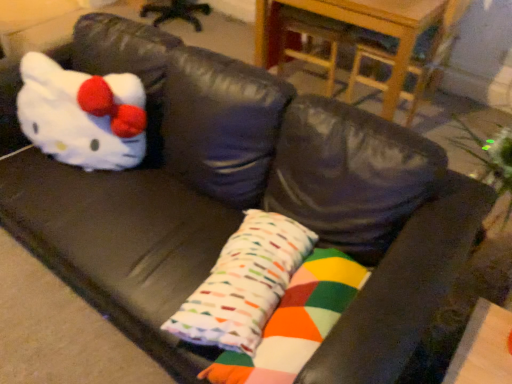
Where is `vacant region above multicolored fabric pillow at center (from a real-world perspective)`? Image resolution: width=512 pixels, height=384 pixels. vacant region above multicolored fabric pillow at center (from a real-world perspective) is located at coordinates (284, 320).